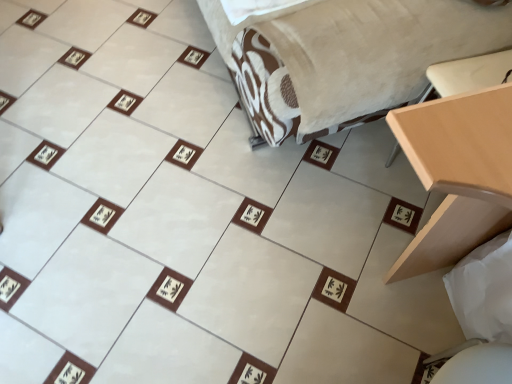
Question: Can you confirm if light wood table at right is thinner than velvet beige bed at center?

Choices:
 (A) yes
 (B) no

Answer: (A)

Question: Is light wood table at right facing away from velvet beige bed at center?

Choices:
 (A) no
 (B) yes

Answer: (A)

Question: Are light wood table at right and velvet beige bed at center located far from each other?

Choices:
 (A) no
 (B) yes

Answer: (A)

Question: Considering the relative sizes of light wood table at right and velvet beige bed at center in the image provided, is light wood table at right smaller than velvet beige bed at center?

Choices:
 (A) no
 (B) yes

Answer: (B)

Question: From a real-world perspective, is light wood table at right on velvet beige bed at center?

Choices:
 (A) yes
 (B) no

Answer: (B)

Question: Are light wood table at right and velvet beige bed at center beside each other?

Choices:
 (A) no
 (B) yes

Answer: (A)

Question: Are velvet beige bed at center and light wood table at right far apart?

Choices:
 (A) no
 (B) yes

Answer: (A)

Question: Does velvet beige bed at center have a larger size compared to light wood table at right?

Choices:
 (A) no
 (B) yes

Answer: (B)

Question: Considering the relative sizes of velvet beige bed at center and light wood table at right in the image provided, is velvet beige bed at center shorter than light wood table at right?

Choices:
 (A) no
 (B) yes

Answer: (B)

Question: Is velvet beige bed at center wider than light wood table at right?

Choices:
 (A) no
 (B) yes

Answer: (B)

Question: Considering the relative sizes of velvet beige bed at center and light wood table at right in the image provided, is velvet beige bed at center thinner than light wood table at right?

Choices:
 (A) yes
 (B) no

Answer: (B)

Question: From a real-world perspective, is velvet beige bed at center on top of light wood table at right?

Choices:
 (A) yes
 (B) no

Answer: (A)

Question: Is light wood table at right to the left of white fabric sheet at lower right from the viewer's perspective?

Choices:
 (A) no
 (B) yes

Answer: (A)